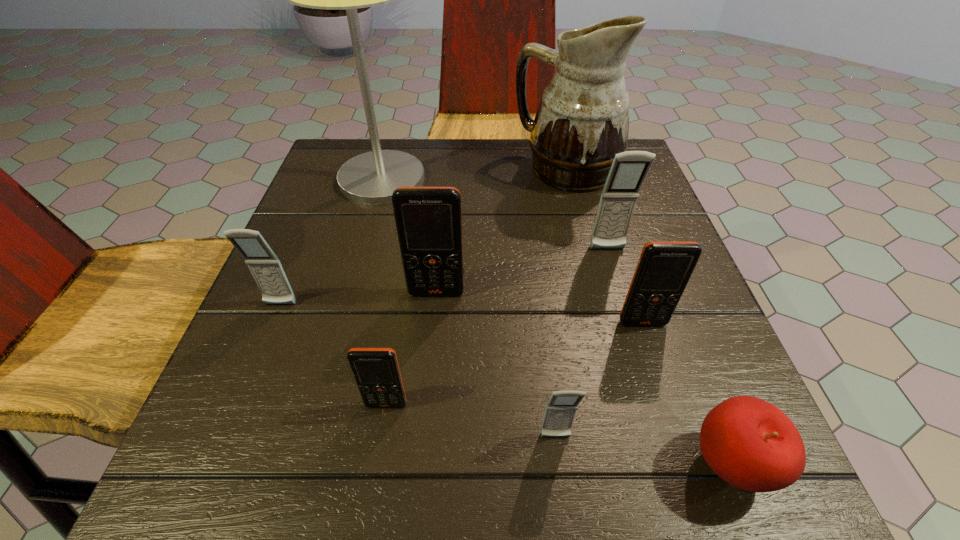
Locate an element on the screen. This screenshot has height=540, width=960. vacant area at the near edge of the desktop is located at coordinates (373, 446).

Find the location of a particular element. This screenshot has width=960, height=540. vacant region at the left edge of the desktop is located at coordinates (303, 243).

What are the coordinates of `free space at the right edge of the desktop` in the screenshot? It's located at (651, 232).

What are the coordinates of `vacant space at the far left corner of the desktop` in the screenshot? It's located at (351, 154).

In the image, there is a desktop. Where is `vacant space at the near right corner`? vacant space at the near right corner is located at coordinates (732, 494).

Find the location of a particular element. vacant point located between the shortest object and the second nearest gray cellular telephone is located at coordinates (505, 384).

The image size is (960, 540). Identify the location of vacant area that lies between the second tallest object and the smallest gray cellular telephone. (561, 303).

Find the location of a particular element. This screenshot has height=540, width=960. unoccupied position between the second nearest gray cellular telephone and the table lamp is located at coordinates (331, 242).

The width and height of the screenshot is (960, 540). In order to click on empty space between the pitcher and the tallest object in this screenshot , I will do `click(474, 174)`.

Identify the location of free point between the shortest object and the second farthest cellular telephone. 583,379.